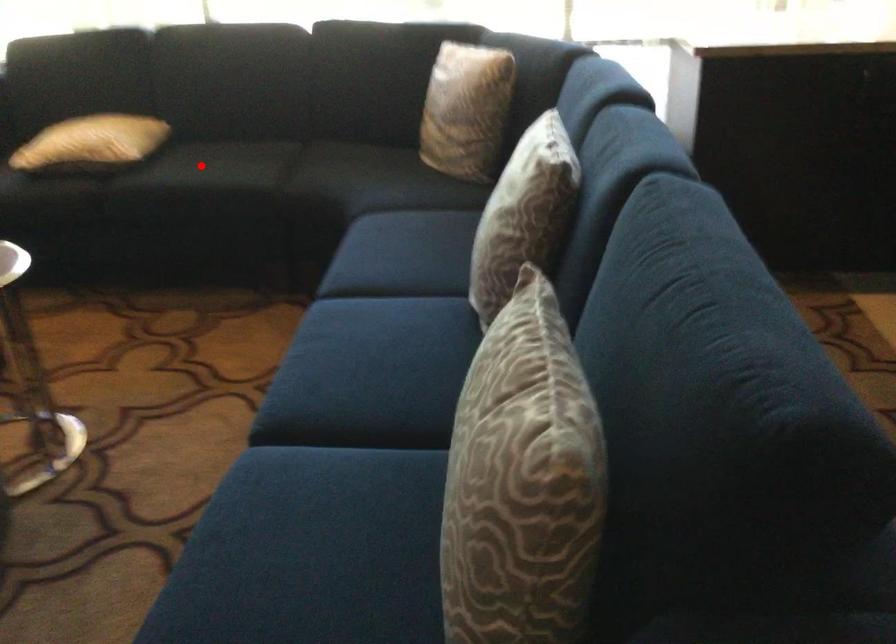
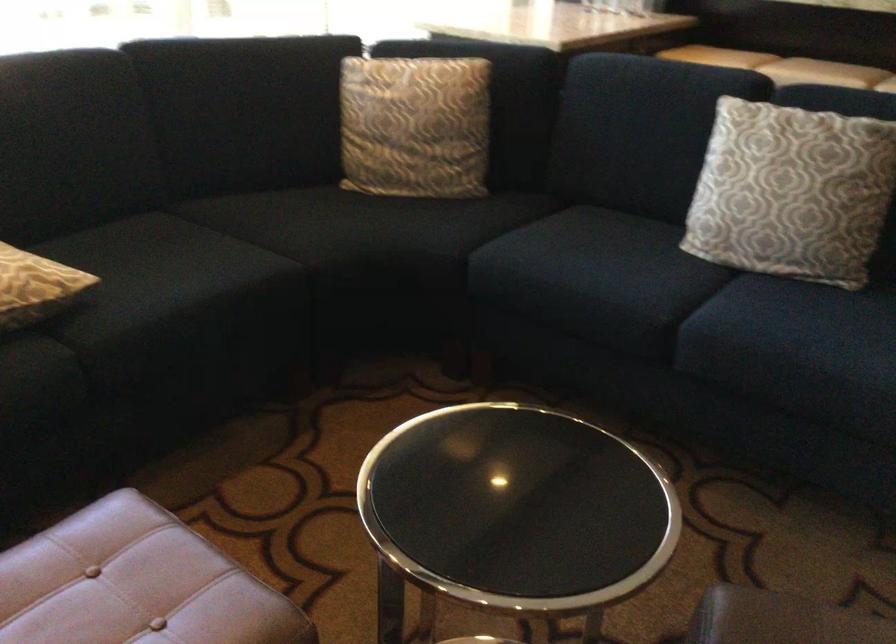
Locate, in the second image, the point that corresponds to the highlighted location in the first image.

(161, 270)